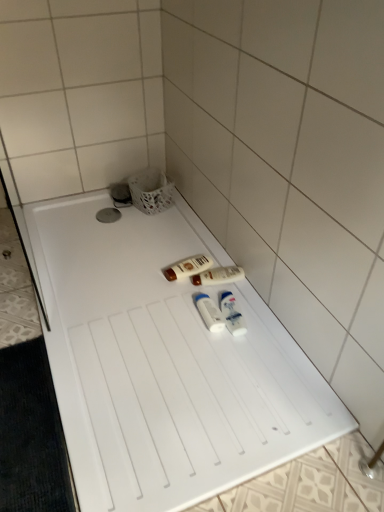
Locate an element on the screen. vacant space that is to the left of white plastic bottles at center, the 1th toiletry from the front is located at coordinates (175, 319).